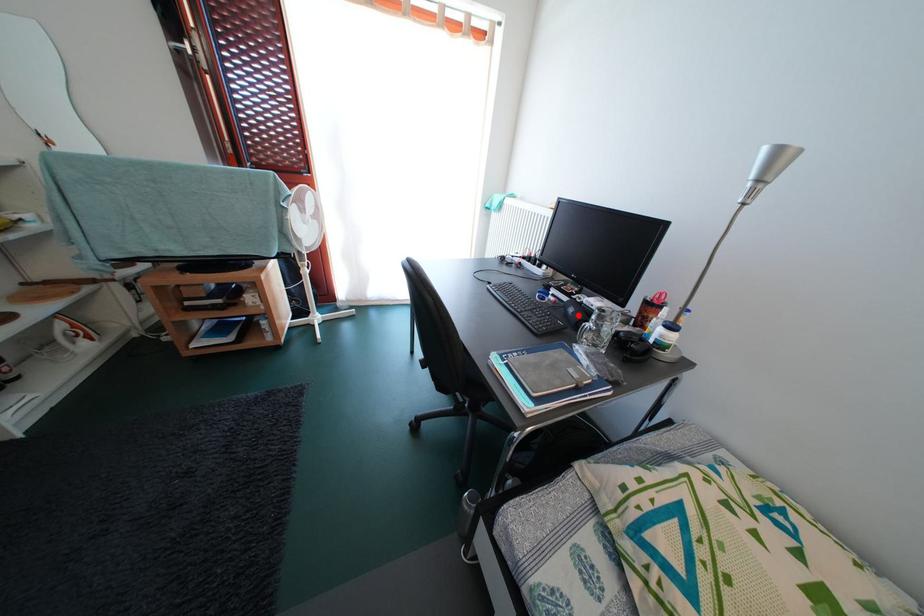
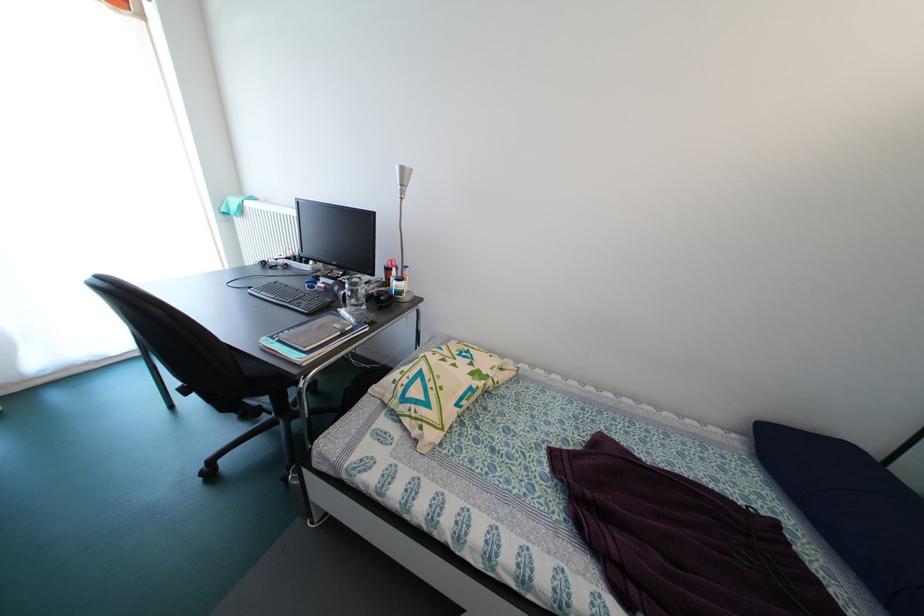
Find the pixel in the second image that matches the highlighted location in the first image.

(344, 294)